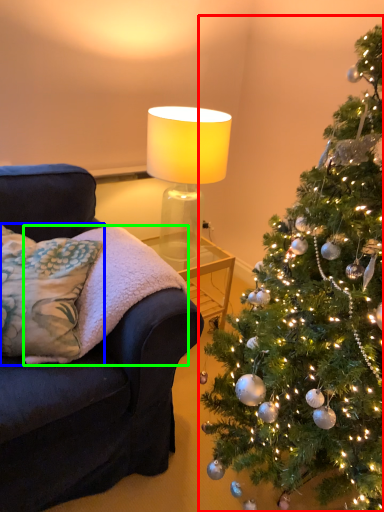
Question: Considering the real-world distances, which object is farthest from christmas tree (highlighted by a red box)? pillow (highlighted by a blue box) or blanket (highlighted by a green box)?

Choices:
 (A) pillow
 (B) blanket

Answer: (A)